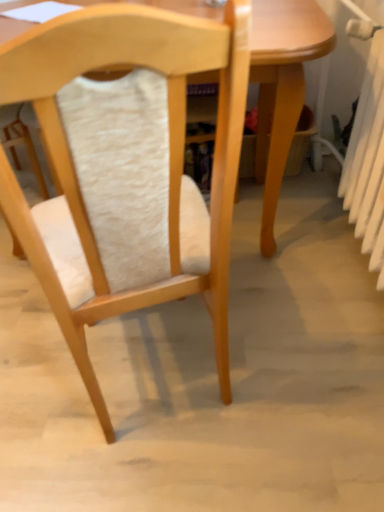
Question: Considering their positions, is white plastic radiator at right located in front of or behind wooden chair at center?

Choices:
 (A) front
 (B) behind

Answer: (B)

Question: From the image's perspective, relative to wooden chair at center, is white plastic radiator at right above or below?

Choices:
 (A) below
 (B) above

Answer: (B)

Question: Estimate the real-world distances between objects in this image. Which object is closer to the light wood table at center?

Choices:
 (A) wooden chair at center
 (B) white plastic radiator at right

Answer: (B)

Question: Considering the real-world distances, which object is farthest from the light wood table at center?

Choices:
 (A) wooden chair at center
 (B) white plastic radiator at right

Answer: (A)